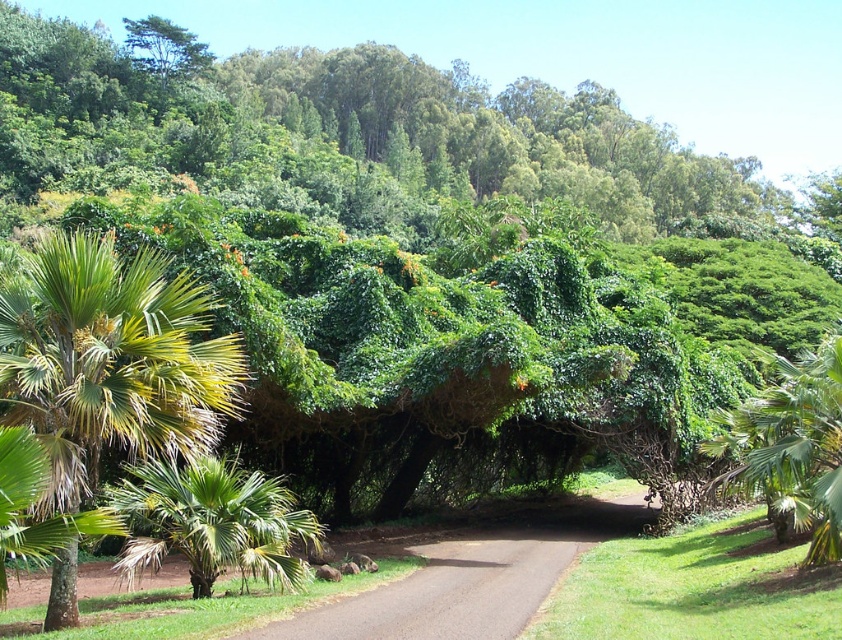
You are a hiker who wants to take a photo of both the green leafy palm at left and the green leafy palm tree at center. Since you have a camera with a fixed focal length, you need to stand at a spot where both are in the frame. Based on their heights, where should you position yourself relative to them?

Since the green leafy palm at left is shorter than the green leafy palm tree at center, you should position yourself closer to the green leafy palm at left to ensure both are visible in the frame.

You are a landscape architect designing a walking path through this tropical area. The path must be at least 3 meters wide to accommodate visitors comfortably. Given the green leafy palm tree at lower left is 9.10 meters away from your current position, can you safely place the path between the tree and the camera without encroaching on the tree?

The distance between the green leafy palm tree at lower left and the camera is 9.10 meters. Since the required path width is 3 meters, there is sufficient space to place the path between the tree and the camera without encroaching on the tree.

You are a hiker walking along the paved pathway in the tropical landscape. You see the green leafy palm at left and the green leafy palm tree at lower left. Which palm is positioned more to the left side of the pathway?

The green leafy palm at left is positioned more to the left side of the pathway compared to the green leafy palm tree at lower left.